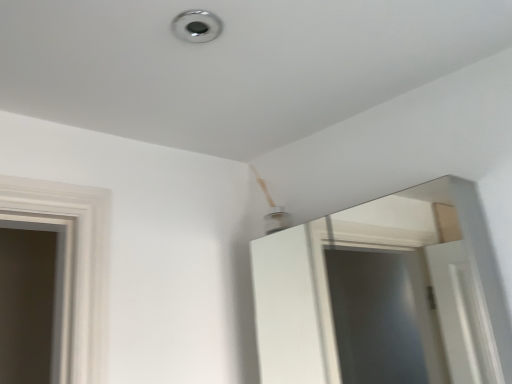
Describe the element at coordinates (384, 294) in the screenshot. I see `white glossy mirror at upper center` at that location.

Locate an element on the screen. This screenshot has width=512, height=384. white glossy mirror at upper center is located at coordinates (384, 294).

I want to click on chrome metallic light at upper center, so (197, 26).

Describe the element at coordinates (197, 26) in the screenshot. I see `chrome metallic light at upper center` at that location.

Locate an element on the screen. The height and width of the screenshot is (384, 512). white glossy mirror at upper center is located at coordinates (384, 294).

Considering the positions of objects white glossy mirror at upper center and chrome metallic light at upper center in the image provided, who is more to the right, white glossy mirror at upper center or chrome metallic light at upper center?

white glossy mirror at upper center.

Is white glossy mirror at upper center in front of or behind chrome metallic light at upper center in the image?

white glossy mirror at upper center is in front of chrome metallic light at upper center.

Which is less distant, (x=393, y=321) or (x=177, y=28)?

Point (x=393, y=321) appears to be farther away from the viewer than point (x=177, y=28).

Based on the photo, from the image's perspective, is white glossy mirror at upper center above or below chrome metallic light at upper center?

white glossy mirror at upper center is situated lower than chrome metallic light at upper center in the image.

From a real-world perspective, is white glossy mirror at upper center below chrome metallic light at upper center?

Yes, from a real-world perspective, white glossy mirror at upper center is below chrome metallic light at upper center.

Which of these two, white glossy mirror at upper center or chrome metallic light at upper center, is thinner?

Thinner between the two is chrome metallic light at upper center.

Who is shorter, white glossy mirror at upper center or chrome metallic light at upper center?

With less height is chrome metallic light at upper center.

Does white glossy mirror at upper center have a smaller size compared to chrome metallic light at upper center?

No, white glossy mirror at upper center is not smaller than chrome metallic light at upper center.

Choose the correct answer: Is white glossy mirror at upper center inside chrome metallic light at upper center or outside it?

white glossy mirror at upper center lies outside chrome metallic light at upper center.

Is white glossy mirror at upper center far away from chrome metallic light at upper center?

Yes, white glossy mirror at upper center is far from chrome metallic light at upper center.

Is white glossy mirror at upper center facing towards chrome metallic light at upper center?

No, white glossy mirror at upper center is not turned towards chrome metallic light at upper center.

Locate an element on the screen. mirror to the right of chrome metallic light at upper center is located at coordinates (384, 294).

Looking at this image, between chrome metallic light at upper center and white glossy mirror at upper center, which one appears on the right side from the viewer's perspective?

white glossy mirror at upper center.

Which object is closer to the camera, chrome metallic light at upper center or white glossy mirror at upper center?

white glossy mirror at upper center is in front.

Is point (193, 15) behind point (444, 181)?

That is False.

Consider the image. From the image's perspective, which one is positioned lower, chrome metallic light at upper center or white glossy mirror at upper center?

white glossy mirror at upper center appears lower in the image.

From a real-world perspective, between chrome metallic light at upper center and white glossy mirror at upper center, who is vertically lower?

From a 3D spatial view, white glossy mirror at upper center is below.

Considering the relative sizes of chrome metallic light at upper center and white glossy mirror at upper center in the image provided, is chrome metallic light at upper center thinner than white glossy mirror at upper center?

Indeed, chrome metallic light at upper center has a lesser width compared to white glossy mirror at upper center.

Considering the sizes of objects chrome metallic light at upper center and white glossy mirror at upper center in the image provided, who is shorter, chrome metallic light at upper center or white glossy mirror at upper center?

With less height is chrome metallic light at upper center.

Between chrome metallic light at upper center and white glossy mirror at upper center, which one has smaller size?

chrome metallic light at upper center.

Is white glossy mirror at upper center surrounded by chrome metallic light at upper center?

No, white glossy mirror at upper center is not surrounded by chrome metallic light at upper center.

Is chrome metallic light at upper center not near white glossy mirror at upper center?

That's right, there is a large distance between chrome metallic light at upper center and white glossy mirror at upper center.

Could you tell me if chrome metallic light at upper center is turned towards white glossy mirror at upper center?

No, chrome metallic light at upper center is not oriented towards white glossy mirror at upper center.

Find the location of a particular element. This screenshot has height=384, width=512. mirror on the right of chrome metallic light at upper center is located at coordinates (384, 294).

At what (x,y) coordinates should I click in order to perform the action: click on light located on the left of white glossy mirror at upper center. Please return your answer as a coordinate pair (x, y). Looking at the image, I should click on (x=197, y=26).

In order to click on mirror on the right side of chrome metallic light at upper center in this screenshot , I will do `click(384, 294)`.